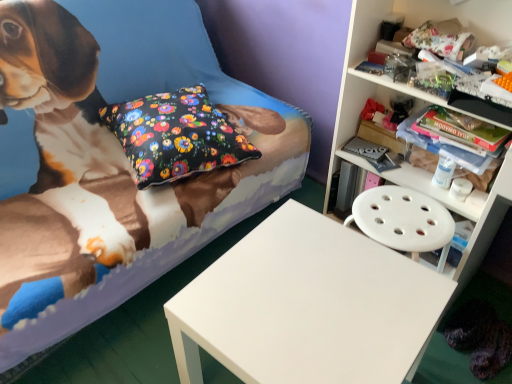
Question: Is white plastic shelf at upper right spatially inside fluffy fabric bed at center, or outside of it?

Choices:
 (A) inside
 (B) outside

Answer: (B)

Question: From the image's perspective, is white plastic shelf at upper right located above or below fluffy fabric bed at center?

Choices:
 (A) above
 (B) below

Answer: (B)

Question: Which is nearer to the white matte table at center?

Choices:
 (A) floral fabric pillow at center
 (B) fluffy fabric bed at center
 (C) white plastic shelf at upper right

Answer: (A)

Question: Which is farther from the white matte table at center?

Choices:
 (A) fluffy fabric bed at center
 (B) floral fabric pillow at center
 (C) white plastic shelf at upper right

Answer: (C)